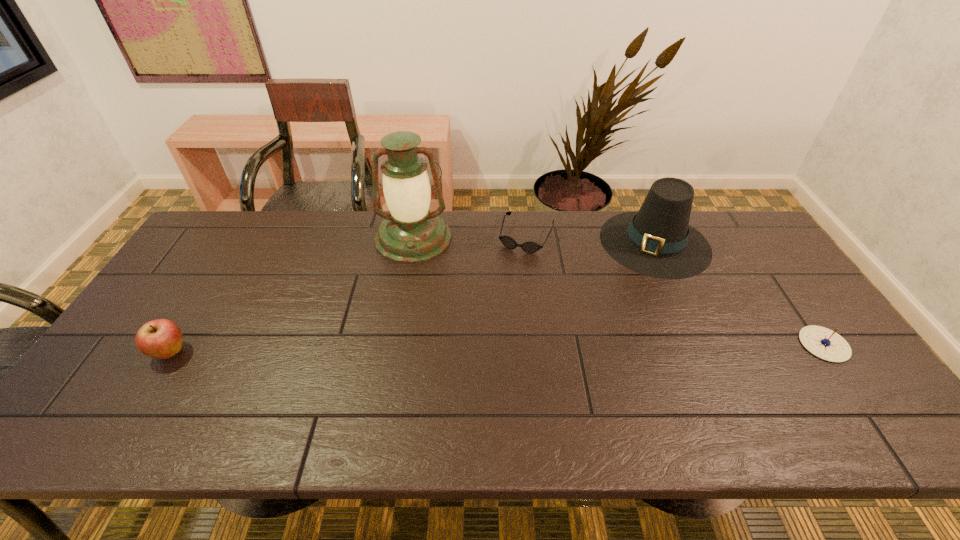
You are a GUI agent. You are given a task and a screenshot of the screen. Output one action in this format:
    pyautogui.click(x=<x>, y=<y>)
    Task: Click on the vacant space that's between the third object from left to right and the rightmost object
    
    Given the screenshot: What is the action you would take?
    pyautogui.click(x=675, y=290)

This screenshot has height=540, width=960. In order to click on free space between the sunglasses and the hat in this screenshot , I will do `click(590, 239)`.

Where is `blank region between the compass and the lantern`? blank region between the compass and the lantern is located at coordinates (618, 291).

Locate an element on the screen. The height and width of the screenshot is (540, 960). free space that is in between the second shortest object and the tallest object is located at coordinates (618, 291).

Find the location of a particular element. vacant area that lies between the sunglasses and the leftmost object is located at coordinates (348, 294).

What are the coordinates of `empty location between the compass and the leftmost object` in the screenshot? It's located at (497, 348).

The image size is (960, 540). I want to click on free point between the tallest object and the second object from right to left, so click(x=534, y=240).

Locate an element on the screen. vacant space in between the shortest object and the second tallest object is located at coordinates (590, 239).

Image resolution: width=960 pixels, height=540 pixels. I want to click on unoccupied area between the sunglasses and the compass, so click(675, 290).

Image resolution: width=960 pixels, height=540 pixels. What are the coordinates of `unoccupied position between the fourth tallest object and the third object from left to right` in the screenshot? It's located at (675, 290).